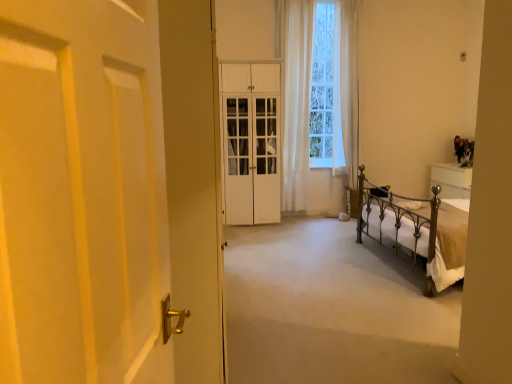
The height and width of the screenshot is (384, 512). Identify the location of white carpet at center. (332, 309).

Locate an element on the screen. This screenshot has width=512, height=384. white matte door at left is located at coordinates (89, 186).

Identify the location of white carpet at center. Image resolution: width=512 pixels, height=384 pixels. [x=332, y=309].

Between gold metal bed at right and white glossy cabinet at center, which one has smaller size?

Smaller between the two is white glossy cabinet at center.

From a real-world perspective, is gold metal bed at right positioned above or below white glossy cabinet at center?

In terms of real-world spatial position, gold metal bed at right is below white glossy cabinet at center.

Which of these two, gold metal bed at right or white glossy cabinet at center, is thinner?

Thinner between the two is white glossy cabinet at center.

Which object is further away from the camera taking this photo, gold metal bed at right or white glossy cabinet at center?

white glossy cabinet at center is more distant.

Could you tell me if gold metal bed at right is turned towards white sheer curtain at center?

No, gold metal bed at right is not facing towards white sheer curtain at center.

From the image's perspective, which object appears higher, gold metal bed at right or white sheer curtain at center?

white sheer curtain at center, from the image's perspective.

You are a GUI agent. You are given a task and a screenshot of the screen. Output one action in this format:
    pyautogui.click(x=<x>, y=<y>)
    Task: Click on the bed below the white sheer curtain at center (from the image's perspective)
    The image size is (512, 384).
    Given the screenshot: What is the action you would take?
    pyautogui.click(x=419, y=231)

Is gold metal bed at right bigger than white sheer curtain at center?

Yes.

Which is closer to the camera, (303, 44) or (234, 98)?

The point (303, 44) is in front.

The width and height of the screenshot is (512, 384). What are the coordinates of `cabinetry located in front of the white sheer curtain at center` in the screenshot? It's located at (251, 141).

How different are the orientations of white sheer curtain at center and white glossy cabinet at center in degrees?

0.457 degrees separate the facing orientations of white sheer curtain at center and white glossy cabinet at center.

Considering the positions of objects white sheer curtain at center and white glossy cabinet at center in the image provided, who is more to the left, white sheer curtain at center or white glossy cabinet at center?

white glossy cabinet at center is more to the left.

Considering the positions of points (266, 266) and (301, 100), is point (266, 266) closer to camera compared to point (301, 100)?

Yes, point (266, 266) is in front of point (301, 100).

Could you tell me if white carpet at center is turned towards white sheer curtain at center?

No, white carpet at center is not oriented towards white sheer curtain at center.

Considering the positions of objects white carpet at center and white sheer curtain at center in the image provided, who is more to the right, white carpet at center or white sheer curtain at center?

white carpet at center.

Does white carpet at center have a larger size compared to white sheer curtain at center?

Yes.

From a real-world perspective, which object rests below the other?

white matte door at left, from a real-world perspective.

Considering the relative sizes of white sheer curtain at center and white matte door at left in the image provided, is white sheer curtain at center wider than white matte door at left?

Correct, the width of white sheer curtain at center exceeds that of white matte door at left.

The width and height of the screenshot is (512, 384). What are the coordinates of `curtain that is behind the white matte door at left` in the screenshot? It's located at (296, 101).

Is white sheer curtain at center facing away from white matte door at left?

That's not correct — white sheer curtain at center is not looking away from white matte door at left.

Is gold metal bed at right aimed at white carpet at center?

Yes.

Image resolution: width=512 pixels, height=384 pixels. I want to click on bed above the white carpet at center (from a real-world perspective), so click(419, 231).

How much distance is there between gold metal bed at right and white carpet at center?

gold metal bed at right is 27.49 inches away from white carpet at center.

From a real-world perspective, is gold metal bed at right above or below white carpet at center?

Clearly, from a real-world perspective, gold metal bed at right is above white carpet at center.

Which point is more distant from viewer, (283,313) or (141,113)?

The point (283,313) is more distant.

Considering the positions of objects white carpet at center and white matte door at left in the image provided, who is behind, white carpet at center or white matte door at left?

white carpet at center is more distant.

Is white carpet at center next to white matte door at left and touching it?

white carpet at center is not next to white matte door at left, and they're not touching.

What are the coordinates of `door above the white carpet at center (from a real-world perspective)` in the screenshot? It's located at (89, 186).

This screenshot has width=512, height=384. I want to click on cabinetry that is above the gold metal bed at right (from the image's perspective), so click(251, 141).

Locate an element on the screen. curtain lying on the left of gold metal bed at right is located at coordinates (296, 101).

When comparing their distances from white glossy cabinet at center, does white carpet at center or white matte door at left seem further?

white matte door at left is positioned further to the anchor white glossy cabinet at center.

When comparing their distances from gold metal bed at right, does white sheer curtain at center or white matte door at left seem closer?

The object closer to gold metal bed at right is white sheer curtain at center.

Considering their positions, is white glossy cabinet at center positioned further to gold metal bed at right than white matte door at left?

white matte door at left is positioned further to the anchor gold metal bed at right.

Looking at the image, which one is located closer to white sheer curtain at center, white glossy cabinet at center or gold metal bed at right?

white glossy cabinet at center is closer to white sheer curtain at center.

When comparing their distances from white glossy cabinet at center, does white matte door at left or gold metal bed at right seem further?

white matte door at left is further to white glossy cabinet at center.

Which object lies nearer to the anchor point white matte door at left, white carpet at center or white glossy cabinet at center?

The object closer to white matte door at left is white carpet at center.

Based on the photo, estimate the real-world distances between objects in this image. Which object is further from white matte door at left, gold metal bed at right or white sheer curtain at center?

white sheer curtain at center lies further to white matte door at left than the other object.

Which object lies nearer to the anchor point gold metal bed at right, white matte door at left or white sheer curtain at center?

Among the two, white sheer curtain at center is located nearer to gold metal bed at right.

The image size is (512, 384). I want to click on bed positioned between white matte door at left and white glossy cabinet at center from near to far, so click(419, 231).

Identify the location of cabinetry between white matte door at left and white sheer curtain at center in the front-back direction. (251, 141).

At what (x,y) coordinates should I click in order to perform the action: click on bed between white carpet at center and white sheer curtain at center from front to back. Please return your answer as a coordinate pair (x, y). Looking at the image, I should click on (419, 231).

This screenshot has height=384, width=512. Find the location of `corridor located between white matte door at left and white glossy cabinet at center in the depth direction`. corridor located between white matte door at left and white glossy cabinet at center in the depth direction is located at coordinates (332, 309).